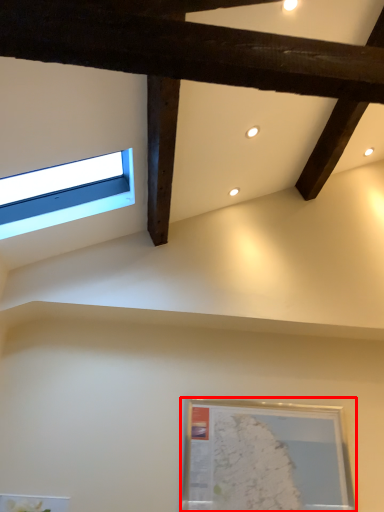
Question: From the image, what is the correct spatial relationship of picture frame (annotated by the red box) in relation to window?

Choices:
 (A) left
 (B) right

Answer: (B)